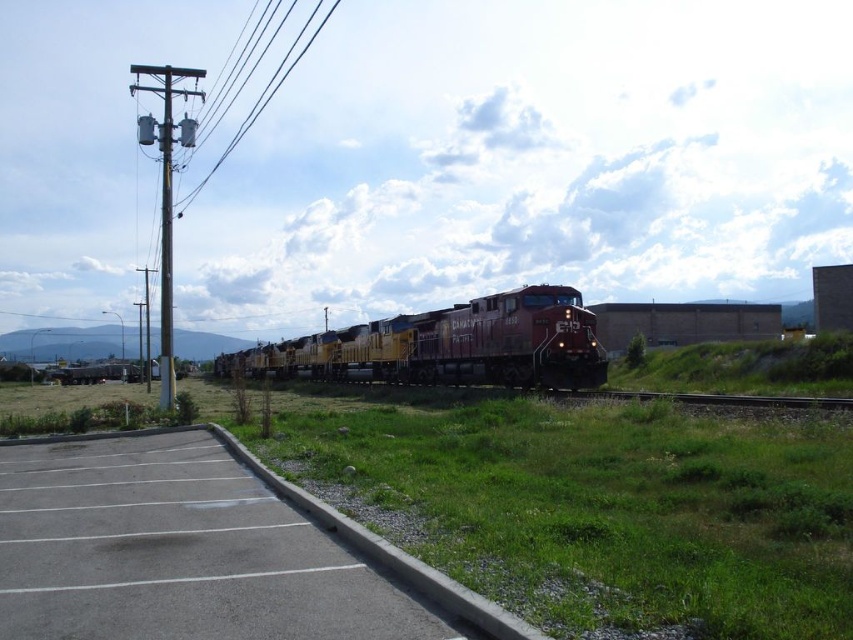
You are a maintenance worker who needs to walk from the gray asphalt parking lot at lower left to the green grass at lower center. Based on the scene, which direction should you move relative to your current position?

The green grass at lower center is below the gray asphalt parking lot at lower left, so you should move downward to reach it.

You are standing at the point closest to the train tracks. There are two points marked in the image, one at coordinates point (x=416, y=516) and another at point (x=196, y=528). Which of these points is closer to you?

Point (x=416, y=516) is in front of point (x=196, y=528), so it is closer to you.